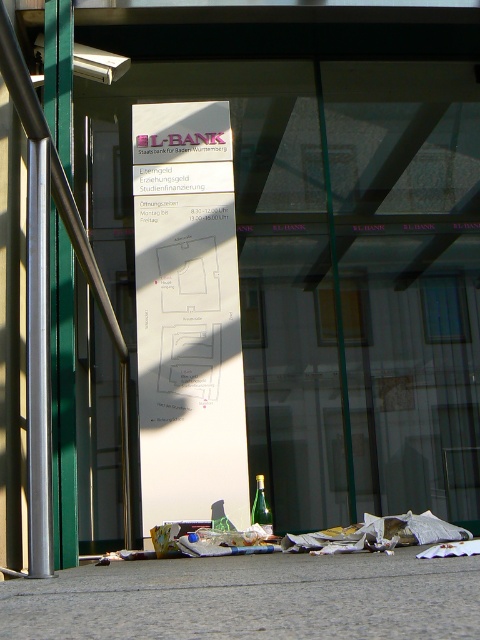
Question: Which point appears closest to the camera in this image?

Choices:
 (A) (60, 422)
 (B) (252, 518)
 (C) (24, 99)

Answer: (C)

Question: Does silver metallic pole at left appear on the left side of green glass bottle at lower center?

Choices:
 (A) no
 (B) yes

Answer: (B)

Question: Is brushed metal rail at left closer to the viewer compared to green glass bottle at lower center?

Choices:
 (A) yes
 (B) no

Answer: (B)

Question: Which point is farther from the camera taking this photo?

Choices:
 (A) (46, 129)
 (B) (69, 160)
 (C) (271, 520)

Answer: (C)

Question: Which object appears farthest from the camera in this image?

Choices:
 (A) silver metallic pole at left
 (B) green glass bottle at lower center
 (C) brushed metal rail at left

Answer: (C)

Question: Does silver metallic pole at left appear on the right side of brushed metal rail at left?

Choices:
 (A) no
 (B) yes

Answer: (A)